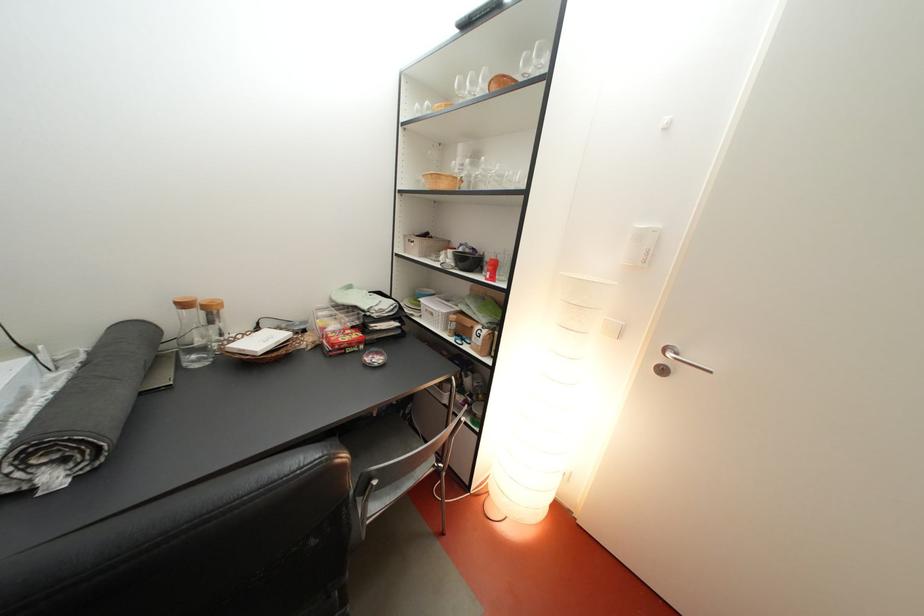
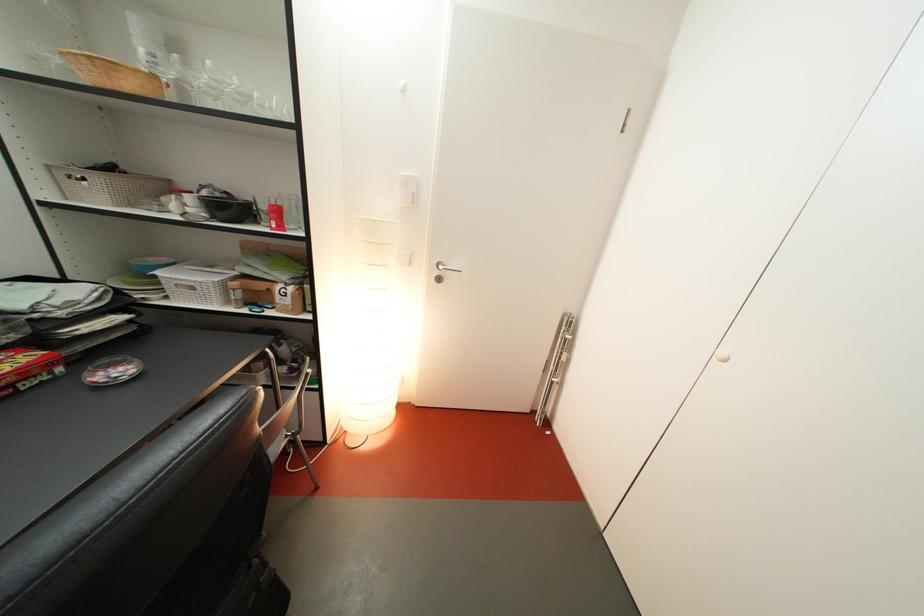
The point at (465,331) is marked in the first image. Where is the corresponding point in the second image?

(249, 301)